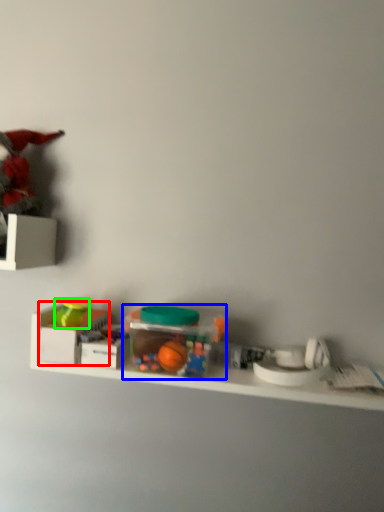
Question: Considering the real-world distances, which object is closest to storage box (highlighted by a red box)? toy (highlighted by a blue box) or toy (highlighted by a green box).

Choices:
 (A) toy
 (B) toy

Answer: (B)